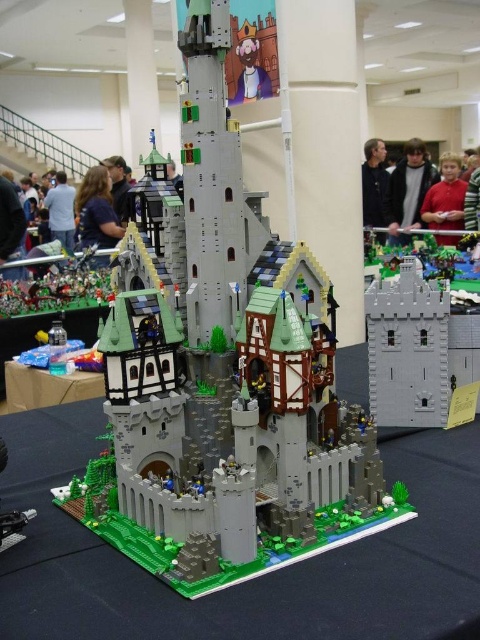
Between brown hair at center and blue shirt at center, which one has more height?

brown hair at center is taller.

Is brown hair at center bigger than blue shirt at center?

Yes, brown hair at center is bigger than blue shirt at center.

What do you see at coordinates (96, 211) in the screenshot? I see `brown hair at center` at bounding box center [96, 211].

Identify the location of brown hair at center. This screenshot has width=480, height=640. (96, 211).

Is brown hair at center wider than matte black hair at upper left?

Yes.

Is brown hair at center above matte black hair at upper left?

No, brown hair at center is not above matte black hair at upper left.

Between point (76, 195) and point (122, 204), which one is positioned in front?

Point (122, 204) is in front.

Find the location of a particular element. This screenshot has height=640, width=480. brown hair at center is located at coordinates (96, 211).

Which of these two, light brown leather jacket at upper center or black matte jacket at upper center, stands shorter?

With less height is light brown leather jacket at upper center.

Does point (432, 166) come behind point (372, 147)?

That is False.

Locate an element on the screen. This screenshot has height=640, width=480. light brown leather jacket at upper center is located at coordinates (408, 189).